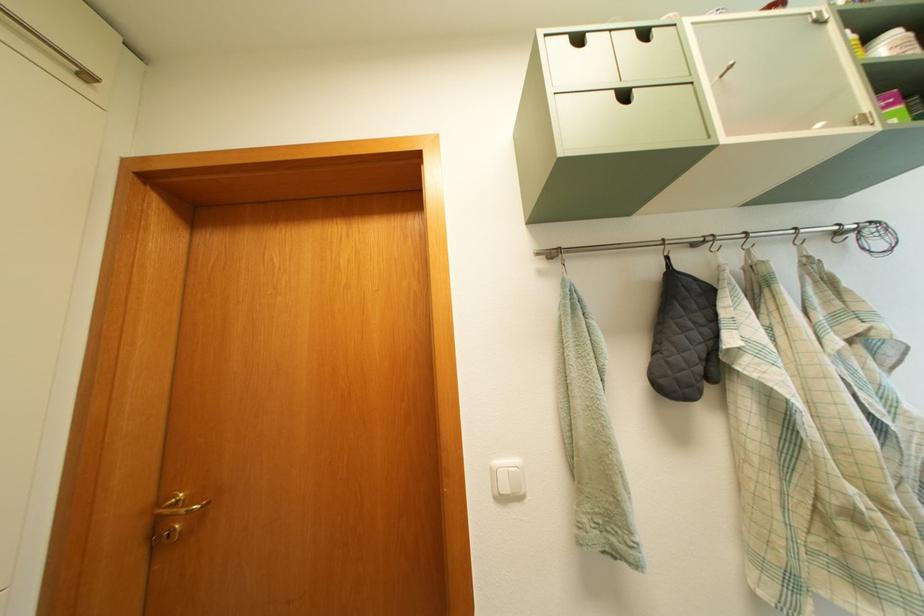
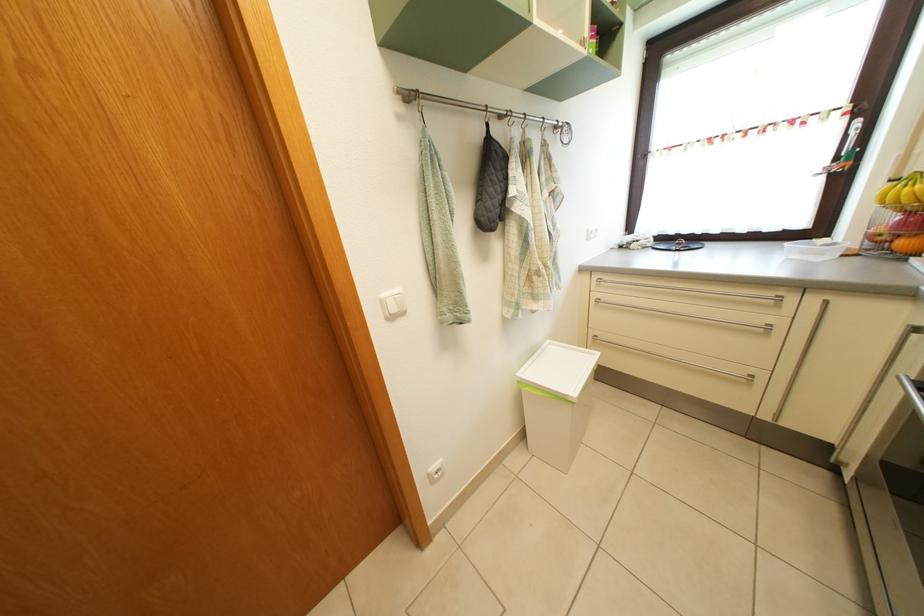
In the second image, find the point that corresponds to the point at 505,469 in the first image.

(392, 302)